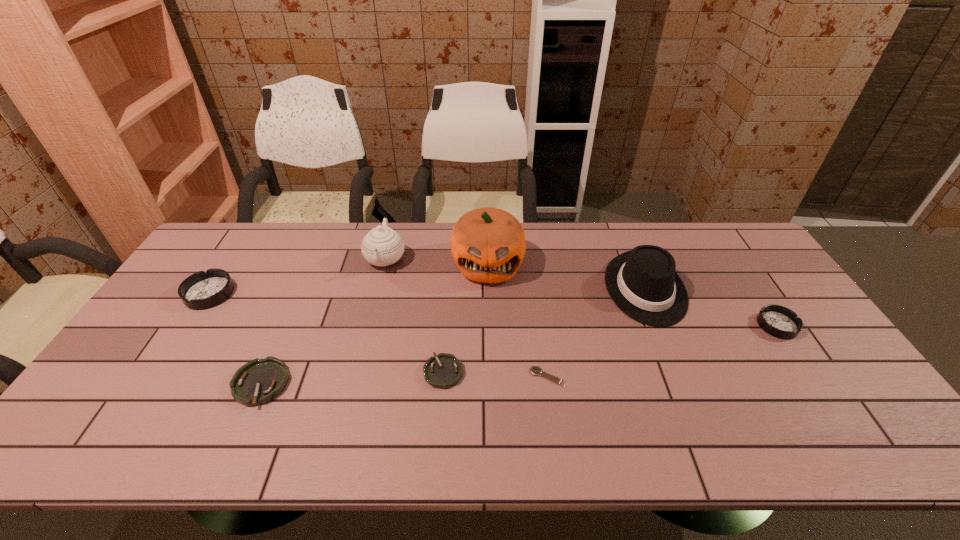
Locate an element on the screen. This screenshot has width=960, height=540. vacant region at the far right corner of the desktop is located at coordinates (698, 230).

Identify the location of vacant space that is in between the nearer dark ashtray and the shortest ashtray. This screenshot has width=960, height=540. (611, 349).

This screenshot has height=540, width=960. I want to click on free area in between the shortest ashtray and the left dark ashtray, so click(326, 333).

I want to click on vacant space in between the watch and the right green ashtray, so click(495, 374).

The height and width of the screenshot is (540, 960). In order to click on vacant space in between the fourth tallest object and the sixth object from right to left in this screenshot , I will do `click(298, 276)`.

This screenshot has height=540, width=960. Find the location of `unoccupied area between the chinaware and the shortest ashtray`. unoccupied area between the chinaware and the shortest ashtray is located at coordinates (415, 315).

Locate an element on the screen. Image resolution: width=960 pixels, height=540 pixels. empty space that is in between the second shortest object and the sixth tallest object is located at coordinates (352, 378).

This screenshot has width=960, height=540. What are the coordinates of `free area in between the chinaware and the rightmost ashtray` in the screenshot? It's located at click(x=581, y=292).

Locate an element on the screen. free spot between the third object from left to right and the pumpkin is located at coordinates (437, 261).

Identify which object is the third closest to the farthest ashtray. Please provide its 2D coordinates. Your answer should be formatted as a tuple, i.e. [(x, y)], where the tuple contains the x and y coordinates of a point satisfying the conditions above.

[(442, 371)]